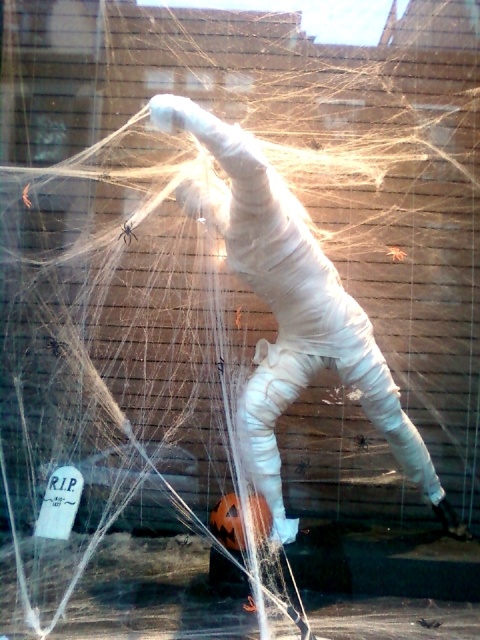
You are a child who wants to touch the black fuzzy spider at center but is scared of spiders. The white matte mummy at center is nearby. Which object is bigger and might be less scary to approach first?

The white matte mummy at center is larger than the black fuzzy spider at center, so approaching the white matte mummy at center first might be less scary due to its bigger size.

You are standing in front of a Halloween display and want to take a closer look at the white matte mummy at center. If you can reach up to 5 feet, will you be able to touch it?

The white matte mummy at center is 5.61 feet away from viewer, so you cannot reach it since your maximum reach is 5 feet.

You are a delivery robot positioned at point 0.5, 0.5 in the scene. You need to deliver a package to the white matte mummy at center. Can you reach it without moving?

The white matte mummy at center is at point (290,310), which is very close to your current position at (240,320). Since the distance between the two points is minimal, you can likely reach it without moving.